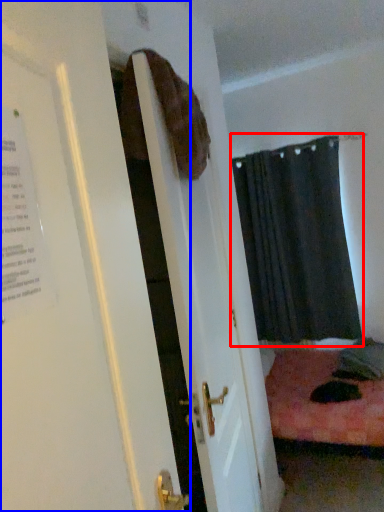
Question: Which point is closer to the camera, curtain (highlighted by a red box) or door (highlighted by a blue box)?

Choices:
 (A) curtain
 (B) door

Answer: (B)